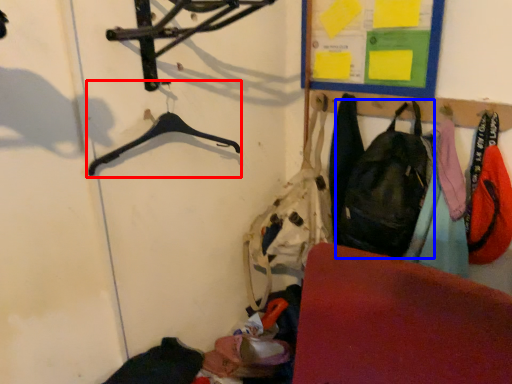
Question: Among these objects, which one is nearest to the camera, hanger (highlighted by a red box) or shoulder bag (highlighted by a blue box)?

Choices:
 (A) hanger
 (B) shoulder bag

Answer: (A)